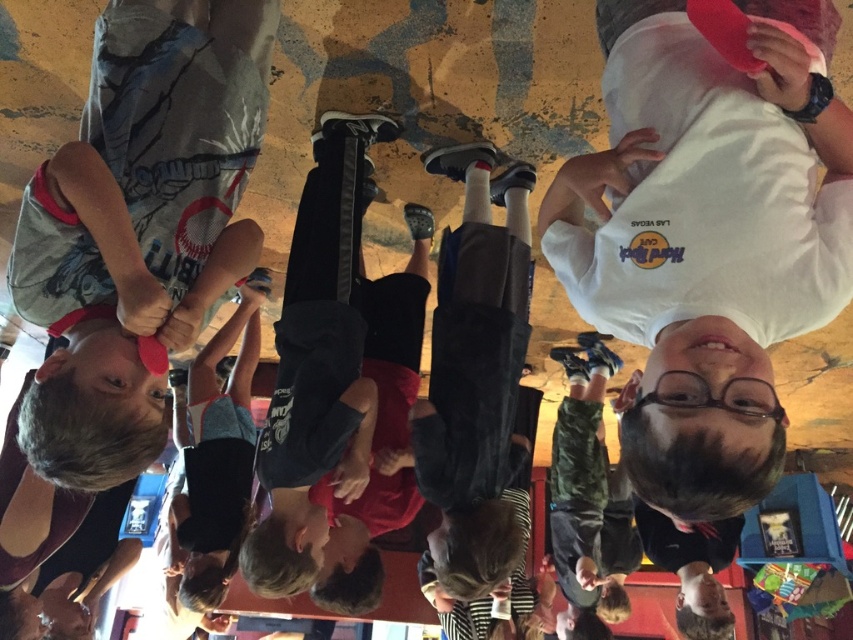
Who is shorter, dark gray pants at center or camouflage pants at lower right?

dark gray pants at center is shorter.

Looking at this image, measure the distance between point (456, 403) and camera.

A distance of 6.95 feet exists between point (456, 403) and camera.

What are the coordinates of `dark gray pants at center` in the screenshot? It's located at [474, 378].

Find the location of a particular element. The height and width of the screenshot is (640, 853). dark gray pants at center is located at coordinates (474, 378).